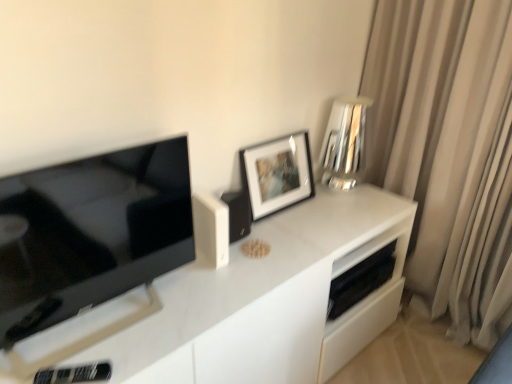
At what (x,y) coordinates should I click in order to perform the action: click on white matte picture frame at upper center. Please return your answer as a coordinate pair (x, y). Looking at the image, I should click on (277, 173).

This screenshot has height=384, width=512. What do you see at coordinates (75, 374) in the screenshot?
I see `black plastic remote control at lower left, which ranks as the first appliance in front-to-back order` at bounding box center [75, 374].

Describe the element at coordinates (345, 143) in the screenshot. The image size is (512, 384). I see `silver reflective vase at upper right, the second appliance when ordered from right to left` at that location.

This screenshot has height=384, width=512. What do you see at coordinates (361, 281) in the screenshot? I see `black matte speaker at lower right, the fifth appliance in the front-to-back sequence` at bounding box center [361, 281].

Find the location of a particular element. The width and height of the screenshot is (512, 384). black glossy tv at left is located at coordinates (91, 233).

What is the approximate height of black glossy tv at left?

It is 18.68 inches.

Where is `beige fabric curtain at right`? The width and height of the screenshot is (512, 384). beige fabric curtain at right is located at coordinates (449, 151).

Locate an element on the screen. The width and height of the screenshot is (512, 384). white matte picture frame at upper center is located at coordinates (277, 173).

Is white matte picture frame at upper center further to the viewer compared to black glossy tv at left?

Yes, white matte picture frame at upper center is further from the camera.

Who is bigger, white matte picture frame at upper center or black glossy tv at left?

Bigger between the two is black glossy tv at left.

Looking at this image, is white matte picture frame at upper center not near black glossy tv at left?

No.

Considering the sizes of white matte picture frame at upper center and black glossy tv at left in the image, is white matte picture frame at upper center taller or shorter than black glossy tv at left?

In the image, white matte picture frame at upper center appears to be shorter than black glossy tv at left.

Considering the relative positions of silver reflective vase at upper right, which is counted as the 4th appliance, starting from the front, and white matte picture frame at upper center in the image provided, is silver reflective vase at upper right, which is counted as the 4th appliance, starting from the front, behind white matte picture frame at upper center?

Yes, silver reflective vase at upper right, which is counted as the 4th appliance, starting from the front, is further from the camera.

From a real-world perspective, between silver reflective vase at upper right, which is the fourth appliance from left to right, and white matte picture frame at upper center, who is vertically higher?

silver reflective vase at upper right, which is the fourth appliance from left to right.

Which object is positioned more to the left, silver reflective vase at upper right, the second appliance when ordered from right to left, or white matte picture frame at upper center?

white matte picture frame at upper center is more to the left.

In the scene shown: Which of these two, black matte speaker at lower right, placed as the 1th appliance when sorted from back to front, or white matte picture frame at upper center, is thinner?

white matte picture frame at upper center.

Looking at this image, is white matte picture frame at upper center a part of black matte speaker at lower right, which appears as the 1th appliance when viewed from the right?

No, white matte picture frame at upper center is not a part of black matte speaker at lower right, which appears as the 1th appliance when viewed from the right.

From a real-world perspective, is black matte speaker at lower right, the fifth appliance in the front-to-back sequence, over white matte picture frame at upper center?

No, from a real-world perspective, black matte speaker at lower right, the fifth appliance in the front-to-back sequence, is not above white matte picture frame at upper center.

Which object is closer to the camera, black matte speaker at lower right, which appears as the 1th appliance when viewed from the right, or white matte picture frame at upper center?

white matte picture frame at upper center is more forward.

In terms of height, does white matte picture frame at upper center look taller or shorter compared to black matte speaker at lower right, marked as the 5th appliance in a left-to-right arrangement?

Considering their sizes, white matte picture frame at upper center has more height than black matte speaker at lower right, marked as the 5th appliance in a left-to-right arrangement.

Does white matte picture frame at upper center come behind black matte speaker at lower right, the fifth appliance in the front-to-back sequence?

That is False.

Looking at this image, does white matte picture frame at upper center have a smaller size compared to black matte speaker at lower right, marked as the 5th appliance in a left-to-right arrangement?

Actually, white matte picture frame at upper center might be larger than black matte speaker at lower right, marked as the 5th appliance in a left-to-right arrangement.

Measure the distance between white matte picture frame at upper center and black matte speaker at lower right, marked as the 5th appliance in a left-to-right arrangement.

A distance of 18.93 inches exists between white matte picture frame at upper center and black matte speaker at lower right, marked as the 5th appliance in a left-to-right arrangement.

Is black glossy tv at left positioned far away from white matte picture frame at upper center?

No.

Which is less distant, (1, 320) or (282, 167)?

The point (1, 320) is in front.

Is black glossy tv at left oriented away from white matte picture frame at upper center?

No.

Considering the relative sizes of black glossy tv at left and white matte picture frame at upper center in the image provided, is black glossy tv at left wider than white matte picture frame at upper center?

Yes, black glossy tv at left is wider than white matte picture frame at upper center.

Is beige fabric curtain at right turned away from black matte speaker at upper center, the third appliance in the left-to-right sequence?

No, black matte speaker at upper center, the third appliance in the left-to-right sequence, is not at the back of beige fabric curtain at right.

Between beige fabric curtain at right and black matte speaker at upper center, acting as the 3th appliance starting from the right, which one has more height?

With more height is beige fabric curtain at right.

Is beige fabric curtain at right in front of black matte speaker at upper center, marked as the 3th appliance in a front-to-back arrangement?

Yes, beige fabric curtain at right is in front of black matte speaker at upper center, marked as the 3th appliance in a front-to-back arrangement.

Considering the positions of points (426, 112) and (249, 224), is point (426, 112) closer to camera compared to point (249, 224)?

No, it is behind (249, 224).

Is white matte picture frame at upper center shorter than white matte speaker at center, arranged as the 2th appliance when viewed from the left?

No, white matte picture frame at upper center is not shorter than white matte speaker at center, arranged as the 2th appliance when viewed from the left.

Can you confirm if white matte picture frame at upper center is bigger than white matte speaker at center, which ranks as the second appliance in front-to-back order?

Indeed, white matte picture frame at upper center has a larger size compared to white matte speaker at center, which ranks as the second appliance in front-to-back order.

Which object is further away from the camera, white matte picture frame at upper center or white matte speaker at center, arranged as the fourth appliance when viewed from the right?

white matte picture frame at upper center is further away from the camera.

At what (x,y) coordinates should I click in order to perform the action: click on television in front of the white matte picture frame at upper center. Please return your answer as a coordinate pair (x, y). Looking at the image, I should click on (91, 233).

In order to click on appliance above the white matte picture frame at upper center (from a real-world perspective) in this screenshot , I will do `click(345, 143)`.

From the image, which object appears to be farther from black matte speaker at lower right, which appears as the 1th appliance when viewed from the right, black glossy tv at left or silver reflective vase at upper right, the second appliance when ordered from right to left?

black glossy tv at left is further to black matte speaker at lower right, which appears as the 1th appliance when viewed from the right.

Estimate the real-world distances between objects in this image. Which object is further from beige fabric curtain at right, silver reflective vase at upper right, the 2th appliance viewed from the back, or white matte picture frame at upper center?

white matte picture frame at upper center lies further to beige fabric curtain at right than the other object.

From the image, which object appears to be nearer to black glossy tv at left, white matte picture frame at upper center or black matte speaker at upper center, the third appliance in the left-to-right sequence?

black matte speaker at upper center, the third appliance in the left-to-right sequence, lies closer to black glossy tv at left than the other object.

Estimate the real-world distances between objects in this image. Which object is further from silver reflective vase at upper right, which is the fourth appliance from left to right, white matte speaker at center, arranged as the 2th appliance when viewed from the left, or beige fabric curtain at right?

Based on the image, white matte speaker at center, arranged as the 2th appliance when viewed from the left, appears to be further to silver reflective vase at upper right, which is the fourth appliance from left to right.

Estimate the real-world distances between objects in this image. Which object is further from black matte speaker at lower right, placed as the 1th appliance when sorted from back to front, beige fabric curtain at right or black glossy tv at left?

Among the two, black glossy tv at left is located further to black matte speaker at lower right, placed as the 1th appliance when sorted from back to front.

From the image, which object appears to be farther from silver reflective vase at upper right, which is the fourth appliance from left to right, black matte speaker at upper center, acting as the 3th appliance starting from the right, or black plastic remote control at lower left, marked as the 5th appliance in a back-to-front arrangement?

Based on the image, black plastic remote control at lower left, marked as the 5th appliance in a back-to-front arrangement, appears to be further to silver reflective vase at upper right, which is the fourth appliance from left to right.

Based on their spatial positions, is beige fabric curtain at right or white matte picture frame at upper center closer to black glossy tv at left?

white matte picture frame at upper center is closer to black glossy tv at left.

From the image, which object appears to be farther from black matte speaker at lower right, marked as the 5th appliance in a left-to-right arrangement, white matte picture frame at upper center or black glossy tv at left?

black glossy tv at left.

What are the coordinates of `television situated between black plastic remote control at lower left, which ranks as the first appliance in front-to-back order, and black matte speaker at lower right, marked as the 5th appliance in a left-to-right arrangement, from left to right` in the screenshot? It's located at (91, 233).

Identify the location of picture frame located between white matte speaker at center, arranged as the 2th appliance when viewed from the left, and beige fabric curtain at right in the left-right direction. This screenshot has width=512, height=384. (277, 173).

I want to click on picture frame between black matte speaker at upper center, which is counted as the 3th appliance, starting from the back, and beige fabric curtain at right from left to right, so click(x=277, y=173).

Locate an element on the screen. curtain between silver reflective vase at upper right, which is the fourth appliance from left to right, and black matte speaker at lower right, marked as the 5th appliance in a left-to-right arrangement, vertically is located at coordinates (449, 151).